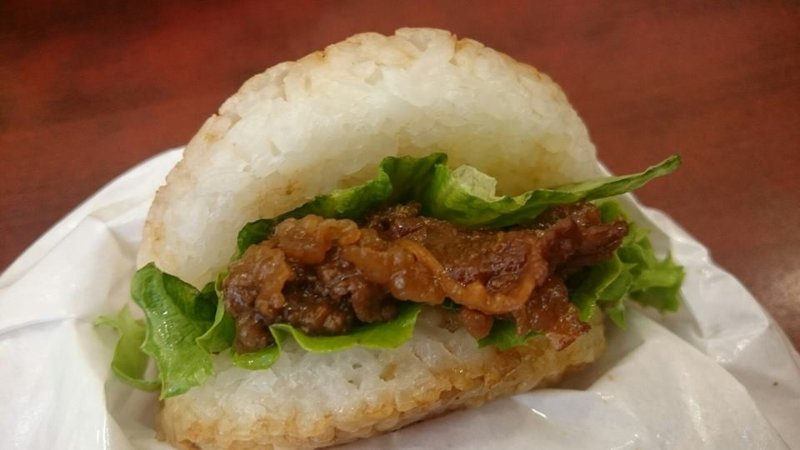
Identify the location of table. The width and height of the screenshot is (800, 450). (602, 70).